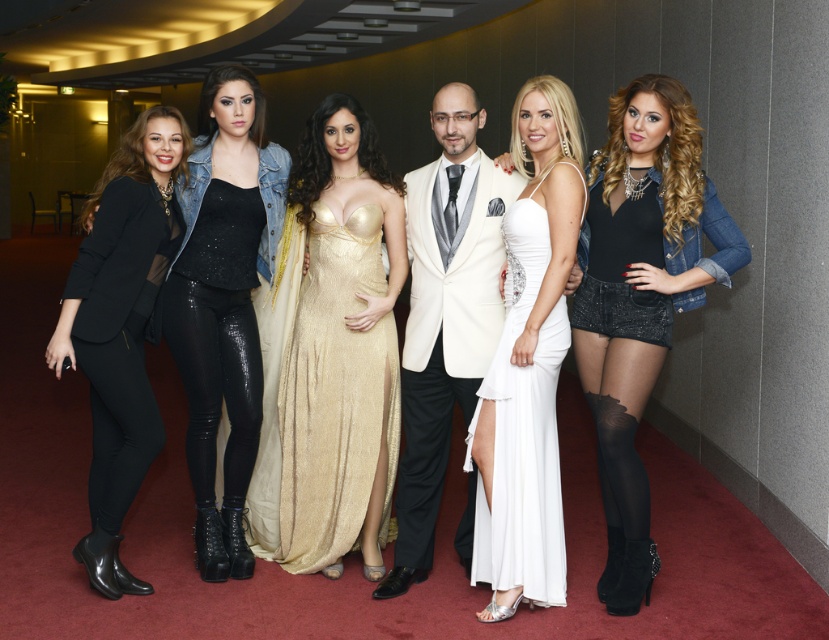
Who is lower down, gold shimmering dress at center or white satin suit at center?

white satin suit at center is below.

Does point (308, 260) come in front of point (490, 259)?

No, it is not.

Locate an element on the screen. The width and height of the screenshot is (829, 640). gold shimmering dress at center is located at coordinates (332, 352).

Is gold shimmering dress at center bigger than white satin dress at center?

Yes.

Who is higher up, gold shimmering dress at center or white satin dress at center?

Positioned higher is gold shimmering dress at center.

Which is behind, point (313, 566) or point (515, 538)?

The point (313, 566) is behind.

Where is `gold shimmering dress at center`? gold shimmering dress at center is located at coordinates (332, 352).

Which is more to the left, white satin dress at center or black leather pants at left?

black leather pants at left

Measure the distance between white satin dress at center and camera.

3.05 meters

Does point (498, 481) lie in front of point (202, 465)?

That is True.

I want to click on white satin dress at center, so click(x=527, y=364).